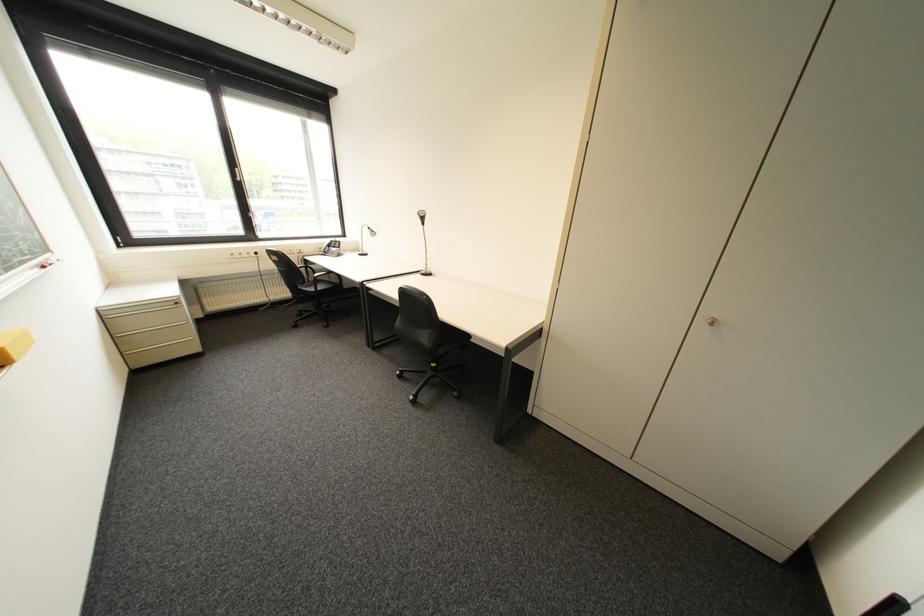
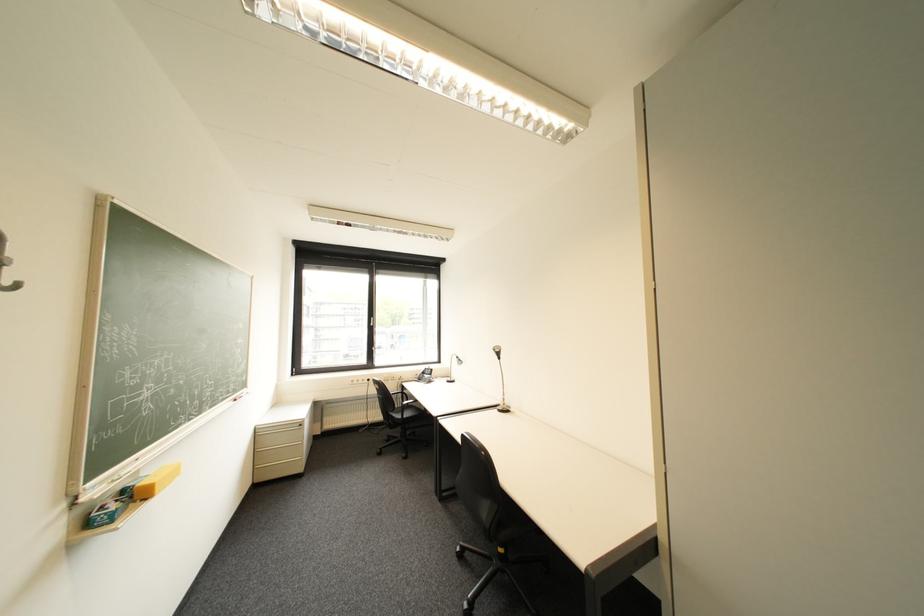
The first image is from the beginning of the video and the second image is from the end. How did the camera likely rotate when shooting the video?

The camera's rotation is toward left-up.